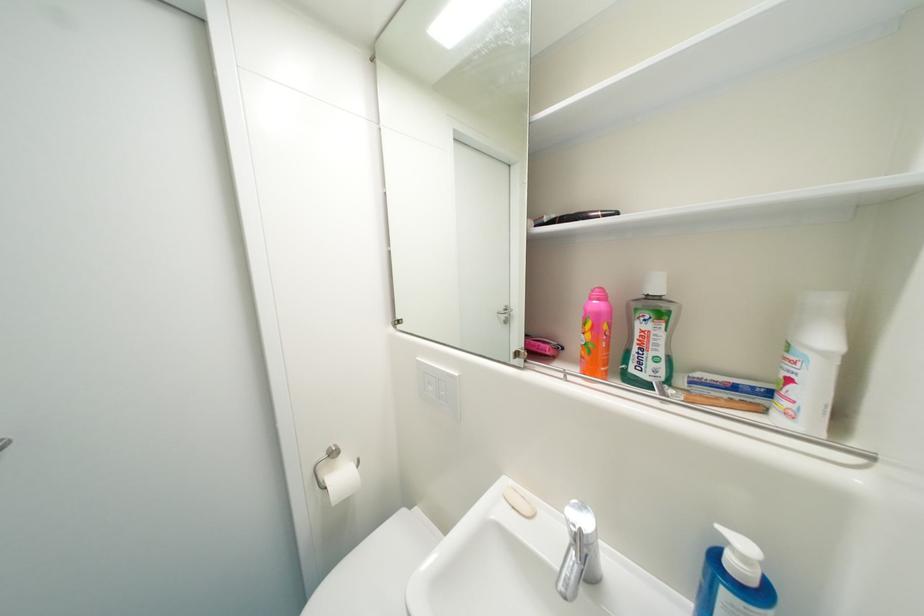
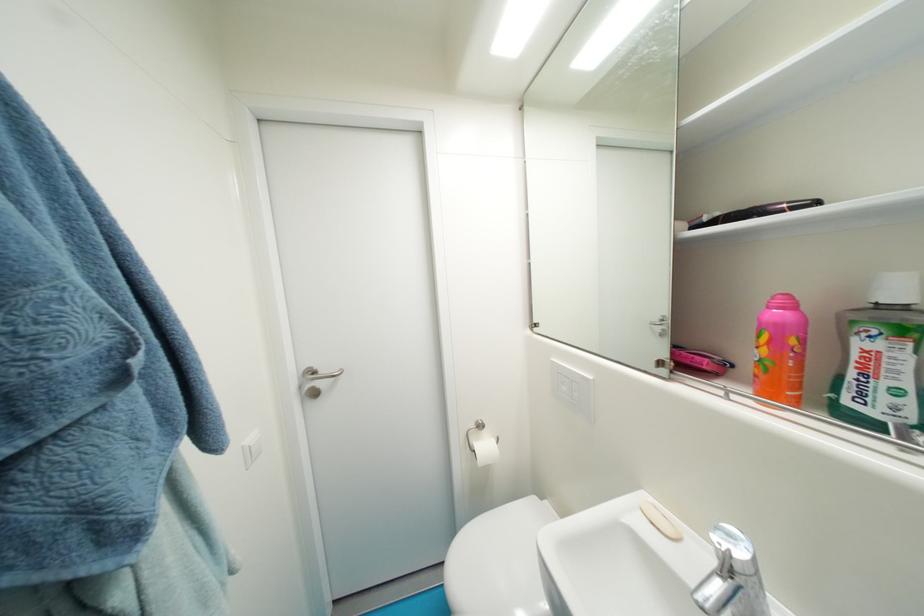
In the second image, find the point that corresponds to point (349, 479) in the first image.

(492, 448)